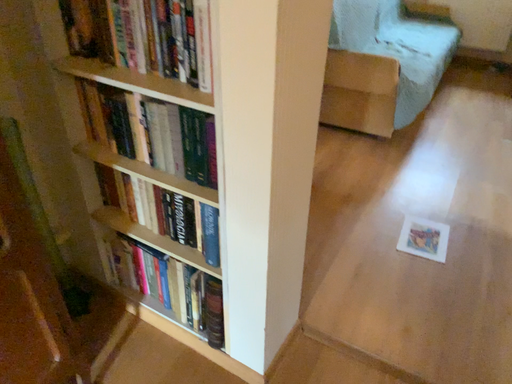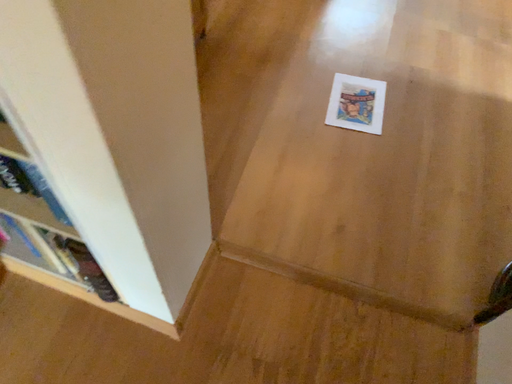
Question: Which way did the camera rotate in the video?

Choices:
 (A) rotated left
 (B) rotated right

Answer: (B)